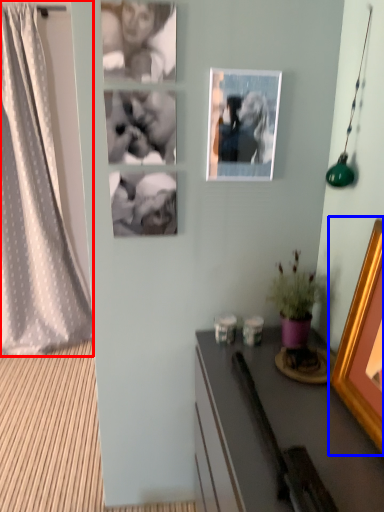
Question: Which of the following is the closest to the observer, curtain (highlighted by a red box) or picture frame (highlighted by a blue box)?

Choices:
 (A) curtain
 (B) picture frame

Answer: (B)